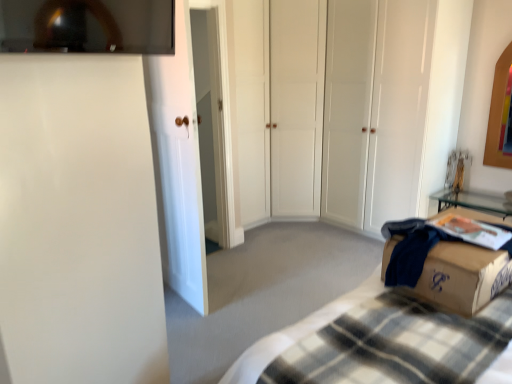
The height and width of the screenshot is (384, 512). In order to click on blank space situated above plaid fabric bed at lower right (from a real-world perspective) in this screenshot , I will do `click(418, 327)`.